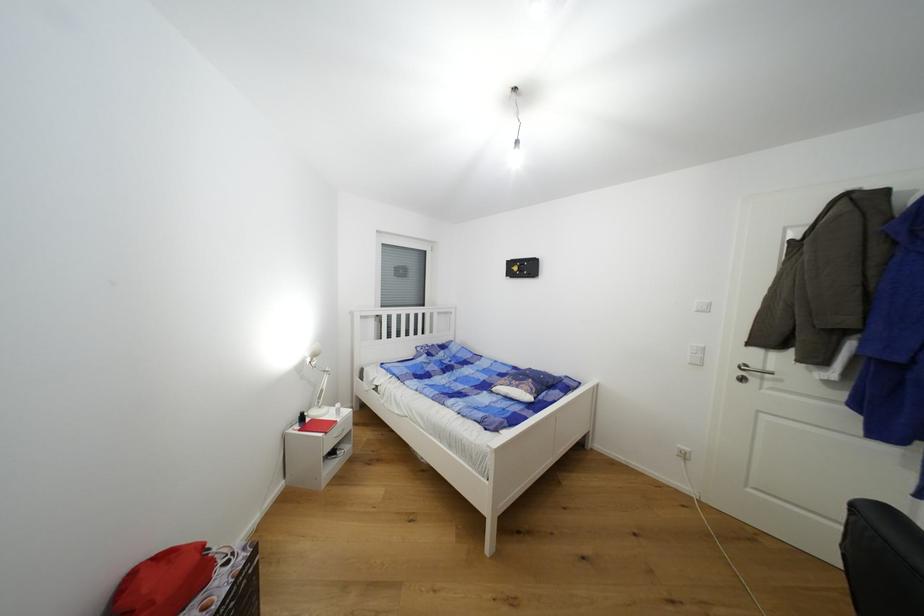
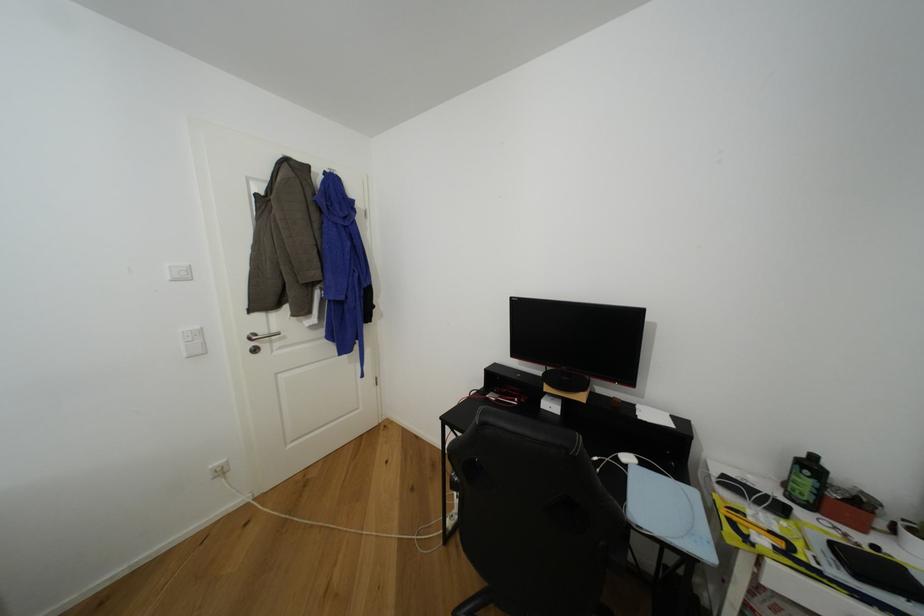
The point at [711,310] is marked in the first image. Where is the corresponding point in the second image?

(190, 278)